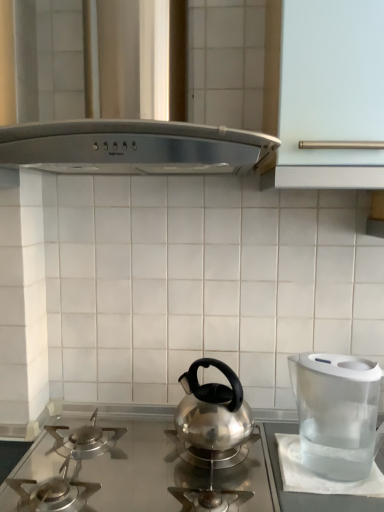
Question: From the image's perspective, is satin silver vent at upper center located above or below transparent plastic water filter at right?

Choices:
 (A) below
 (B) above

Answer: (B)

Question: From a real-world perspective, relative to transparent plastic water filter at right, is satin silver vent at upper center vertically above or below?

Choices:
 (A) above
 (B) below

Answer: (A)

Question: Based on their relative distances, which object is nearer to the satin silver gas stove at center?

Choices:
 (A) transparent plastic water filter at right
 (B) satin silver vent at upper center

Answer: (A)

Question: Estimate the real-world distances between objects in this image. Which object is farther from the satin silver vent at upper center?

Choices:
 (A) satin silver gas stove at center
 (B) transparent plastic water filter at right

Answer: (A)